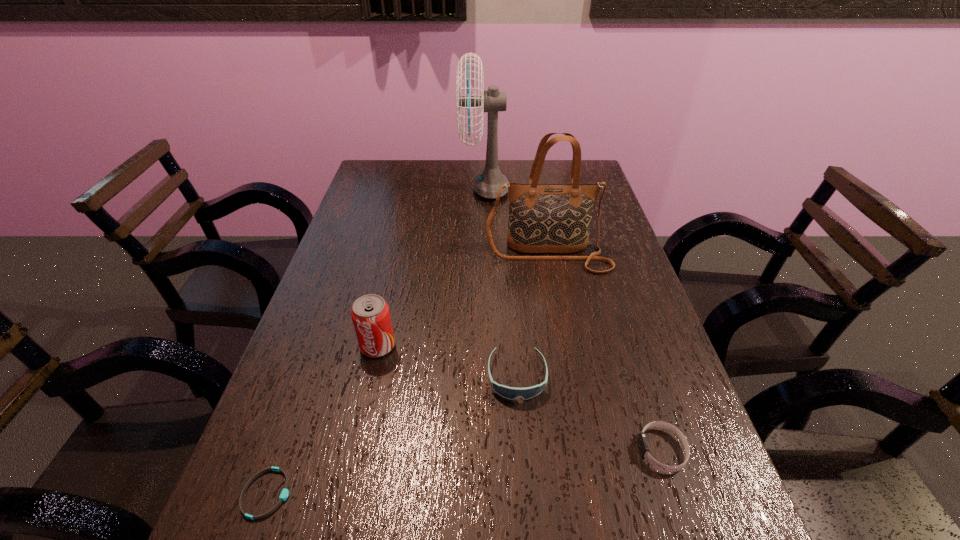
Where is `free point located 0.290m on the buckle of the shorter wristband`? Image resolution: width=960 pixels, height=540 pixels. free point located 0.290m on the buckle of the shorter wristband is located at coordinates (463, 494).

Image resolution: width=960 pixels, height=540 pixels. In order to click on object at the far edge in this screenshot , I will do `click(487, 184)`.

Find the location of a particular element. The height and width of the screenshot is (540, 960). soda can located in the left edge section of the desktop is located at coordinates (370, 314).

Identify the location of wristband positioned at the left edge. (284, 494).

The width and height of the screenshot is (960, 540). What are the coordinates of `handbag positioned at the right edge` in the screenshot? It's located at (548, 218).

Where is `wristband that is at the right edge`? The height and width of the screenshot is (540, 960). wristband that is at the right edge is located at coordinates (642, 443).

Identify the location of free point at the far edge. This screenshot has height=540, width=960. (444, 166).

I want to click on free space at the left edge of the desktop, so click(384, 209).

Find the location of a particular element. blank space at the right edge of the desktop is located at coordinates (581, 267).

Image resolution: width=960 pixels, height=540 pixels. What are the coordinates of `blank space at the far left corner` in the screenshot? It's located at (408, 178).